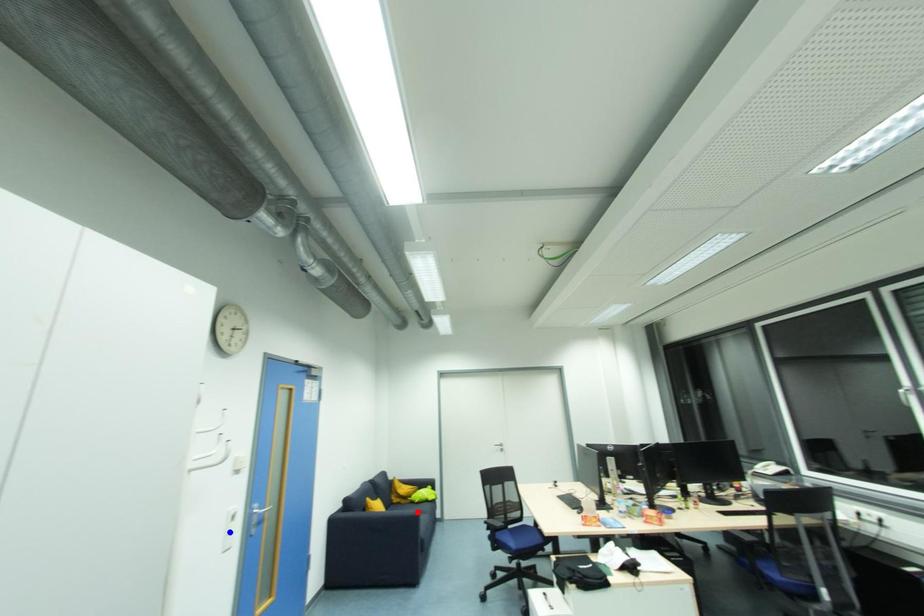
Question: Which of the two points in the image is closer to the camera?

Choices:
 (A) Blue point is closer.
 (B) Red point is closer.

Answer: (A)